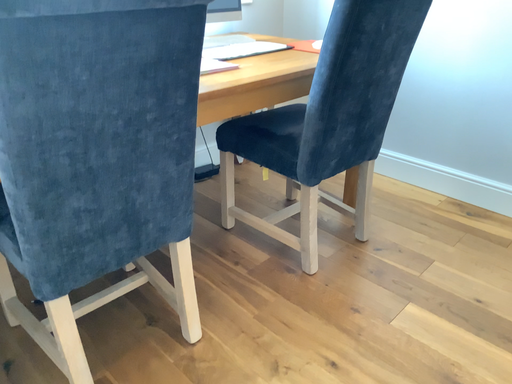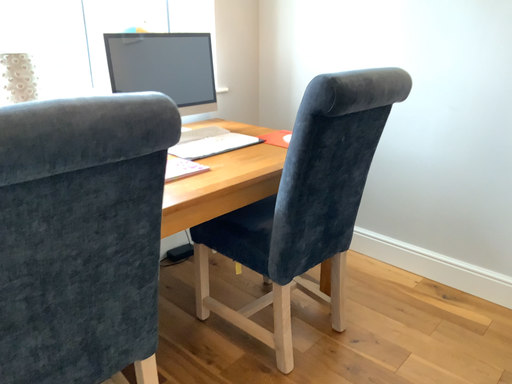
Question: Which way did the camera rotate in the video?

Choices:
 (A) rotated upward
 (B) rotated downward

Answer: (A)